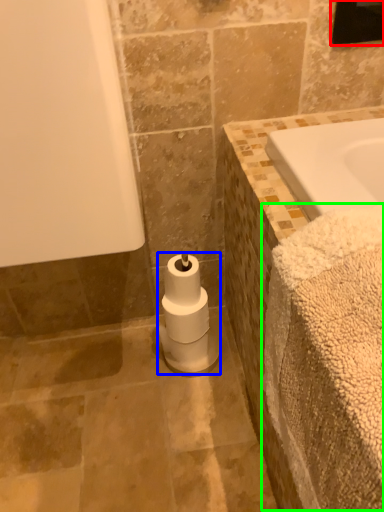
Question: Based on their relative distances, which object is farther from mirror (highlighted by a red box)? Choose from toilet paper (highlighted by a blue box) and bath towel (highlighted by a green box).

Choices:
 (A) toilet paper
 (B) bath towel

Answer: (A)